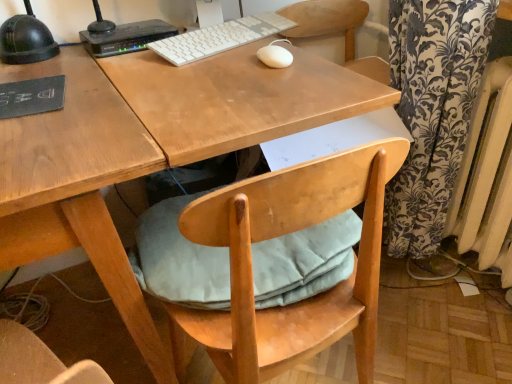
Image resolution: width=512 pixels, height=384 pixels. I want to click on vacant region in front of black plastic router at upper left, so click(x=115, y=61).